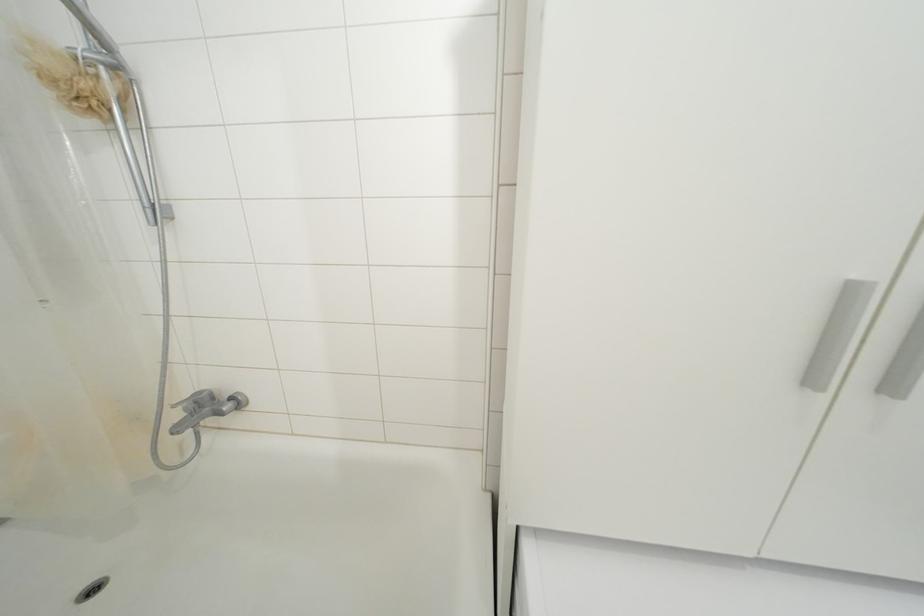
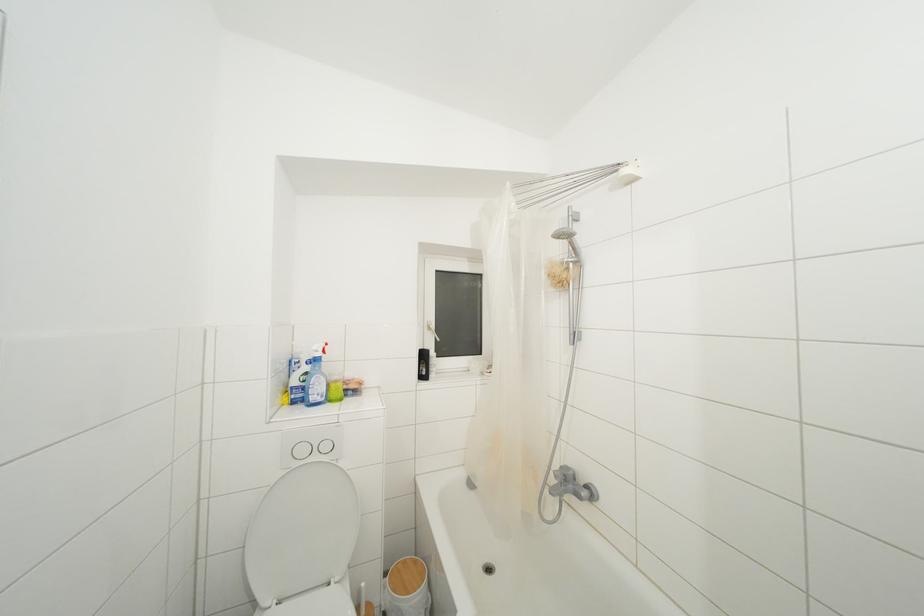
The point at (200, 407) is marked in the first image. Where is the corresponding point in the second image?

(568, 480)